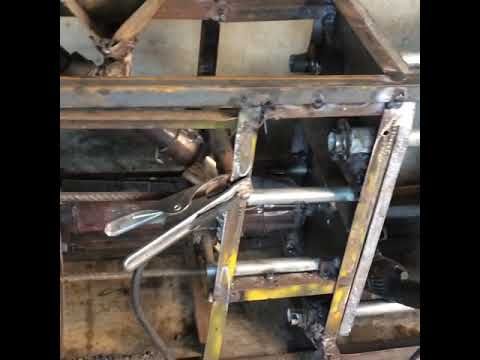
The image size is (480, 360). I want to click on floor, so click(x=251, y=336), click(x=108, y=320).